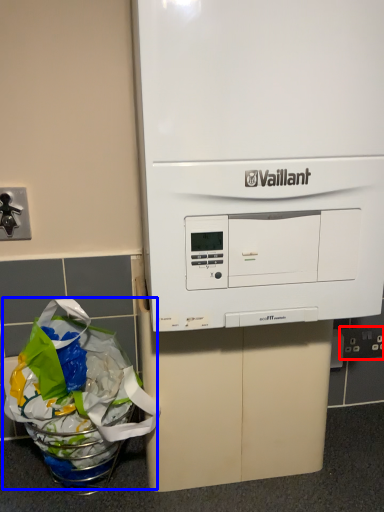
Question: Which object is closer to the camera taking this photo, electric outlet (highlighted by a red box) or grocery bag (highlighted by a blue box)?

Choices:
 (A) electric outlet
 (B) grocery bag

Answer: (B)